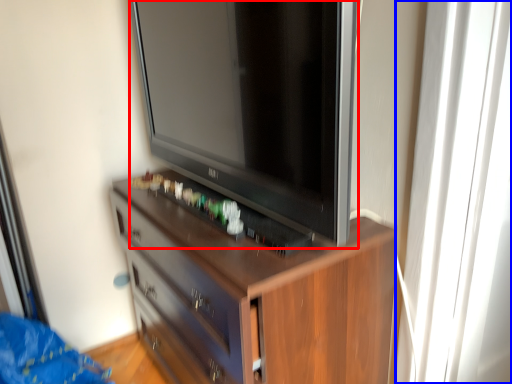
Question: Among these objects, which one is nearest to the camera, television (highlighted by a red box) or glass door (highlighted by a blue box)?

Choices:
 (A) television
 (B) glass door

Answer: (A)